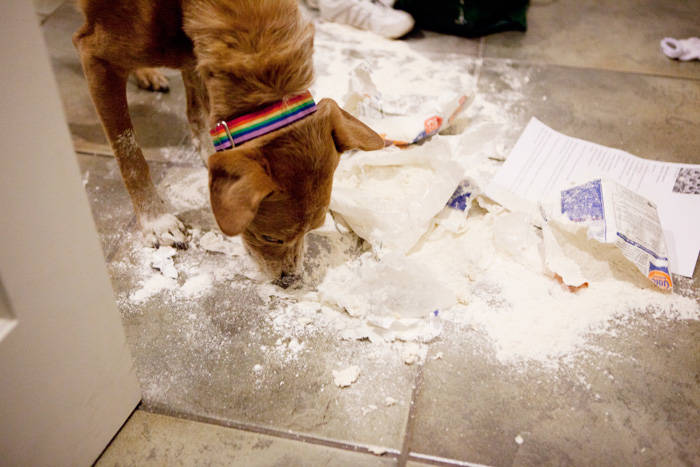
Where is `door`? door is located at coordinates (52, 290).